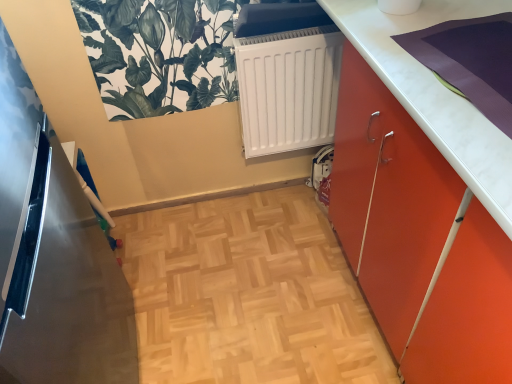
Where is `empty space that is ontop of white matte radiator at center (from a real-world perspective)`? The height and width of the screenshot is (384, 512). empty space that is ontop of white matte radiator at center (from a real-world perspective) is located at coordinates (295, 31).